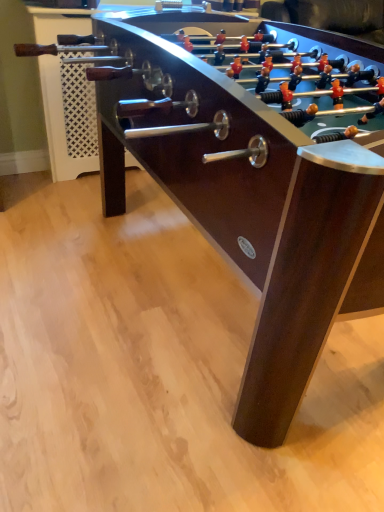
This screenshot has width=384, height=512. What do you see at coordinates (254, 183) in the screenshot?
I see `dark wood foosball table at center` at bounding box center [254, 183].

At what (x,y) coordinates should I click in order to perform the action: click on dark wood foosball table at center. Please return your answer as a coordinate pair (x, y). Looking at the image, I should click on (254, 183).

This screenshot has width=384, height=512. What are the coordinates of `dark wood foosball table at center` in the screenshot? It's located at pos(254,183).